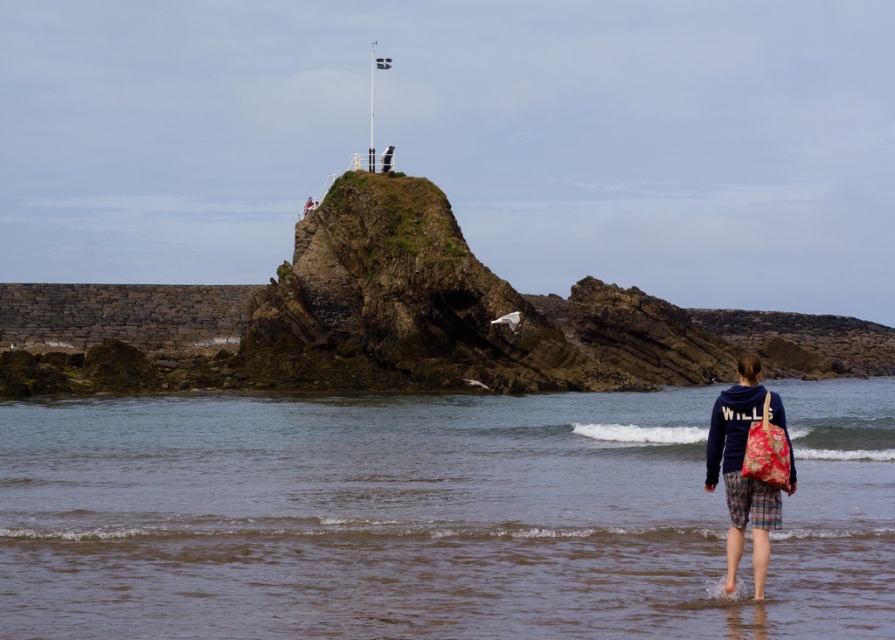
Question: Which point appears closest to the camera in this image?

Choices:
 (A) (842, 605)
 (B) (756, 548)

Answer: (A)

Question: Does brown sand at lower center lie behind dark blue fleece jacket at lower center?

Choices:
 (A) no
 (B) yes

Answer: (A)

Question: From the image, what is the correct spatial relationship of brown sand at lower center in relation to dark blue fleece jacket at lower center?

Choices:
 (A) below
 (B) above

Answer: (A)

Question: Is brown sand at lower center smaller than dark blue fleece jacket at lower center?

Choices:
 (A) no
 (B) yes

Answer: (A)